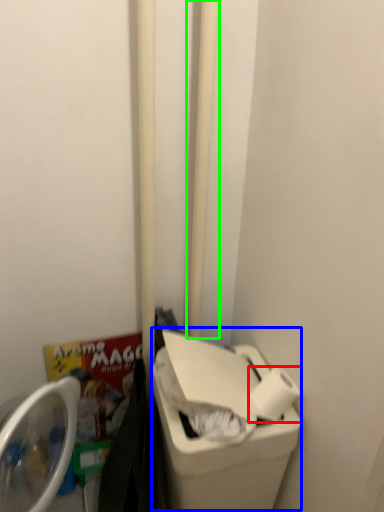
Question: Based on their relative distances, which object is nearer to toilet paper (highlighted by a red box)? Choose from recycling bin (highlighted by a blue box) and pole (highlighted by a green box).

Choices:
 (A) recycling bin
 (B) pole

Answer: (A)